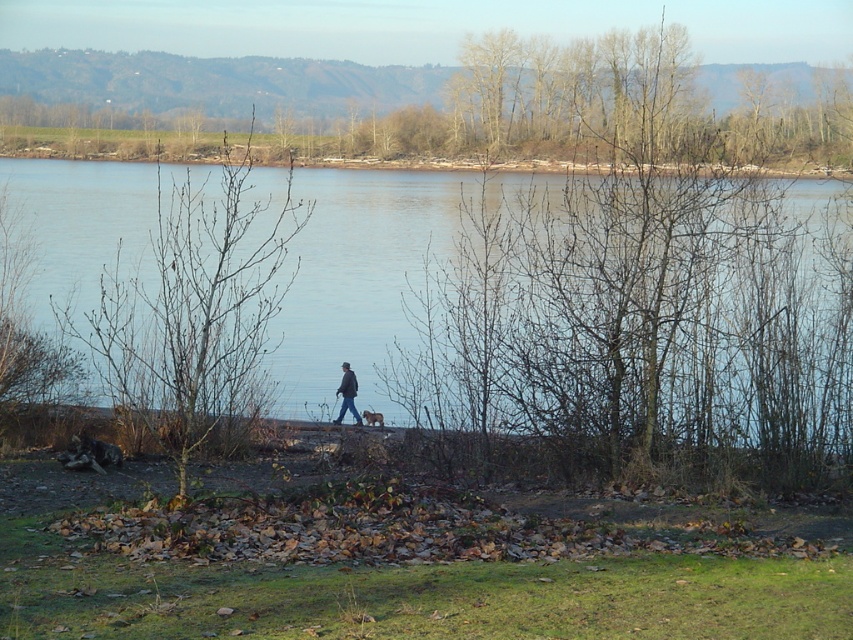
You are a photographer standing at the riverside. You want to take a photo of the brown fur dog at center and the bare branches at left. If your camera can focus on objects within a 3 meter range, will both subjects be in focus?

The bare branches at left is 3.85 meters away from brown fur dog at center. Since the distance between them exceeds the camera focus range of 3 meters, both subjects cannot be in focus simultaneously.

You are a photographer standing at the riverside. You want to take a photo of the dark gray jacket at center and the brown fur dog at center so that they both appear clearly in the frame. Given that your camera has a depth of field that can focus on objects within a 10 inch range, will both subjects be in focus?

The dark gray jacket at center and brown fur dog at center are 9.42 inches apart. Since the distance between them is within the 10 inch range of the camera, both subjects will be in focus.

You are a painter standing on the riverbank. You want to paint a landscape that includes both the blue water at center and the bare branches at center. If your canvas is 1.5 meters wide, will you be able to fit both elements on the canvas without moving your position?

The distance between the blue water at center and the bare branches at center is 1.40 meters. Since your canvas is 1.5 meters wide, which is wider than the 1.40 meters separating them, you can fit both elements on the canvas without moving.